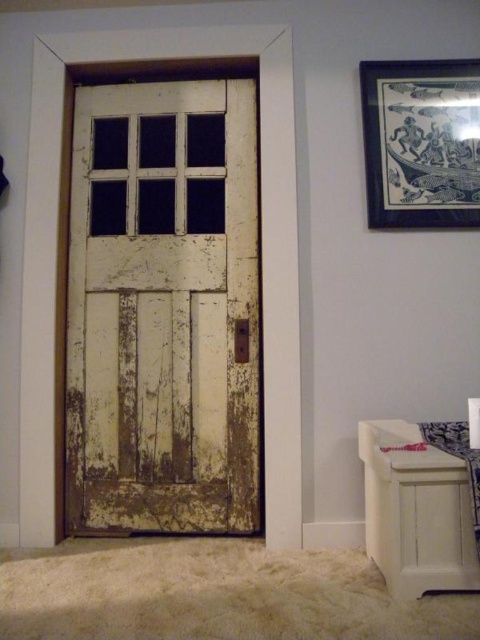
Question: Considering the relative positions of white weathered wood door at center and black paper picture frame at upper right in the image provided, where is white weathered wood door at center located with respect to black paper picture frame at upper right?

Choices:
 (A) above
 (B) below

Answer: (B)

Question: Which of the following is the closest to the observer?

Choices:
 (A) black paper picture frame at upper right
 (B) white weathered wood door at center

Answer: (A)

Question: Can you confirm if white weathered wood door at center is positioned below black paper picture frame at upper right?

Choices:
 (A) no
 (B) yes

Answer: (B)

Question: Among these points, which one is farthest from the camera?

Choices:
 (A) (70, 429)
 (B) (464, 116)

Answer: (A)

Question: In this image, where is white weathered wood door at center located relative to black paper picture frame at upper right?

Choices:
 (A) right
 (B) left

Answer: (B)